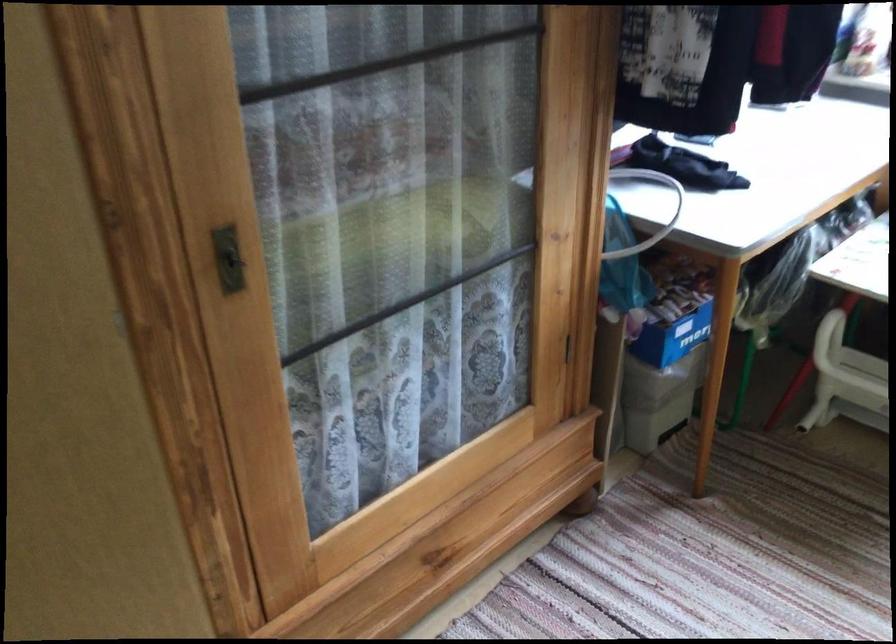
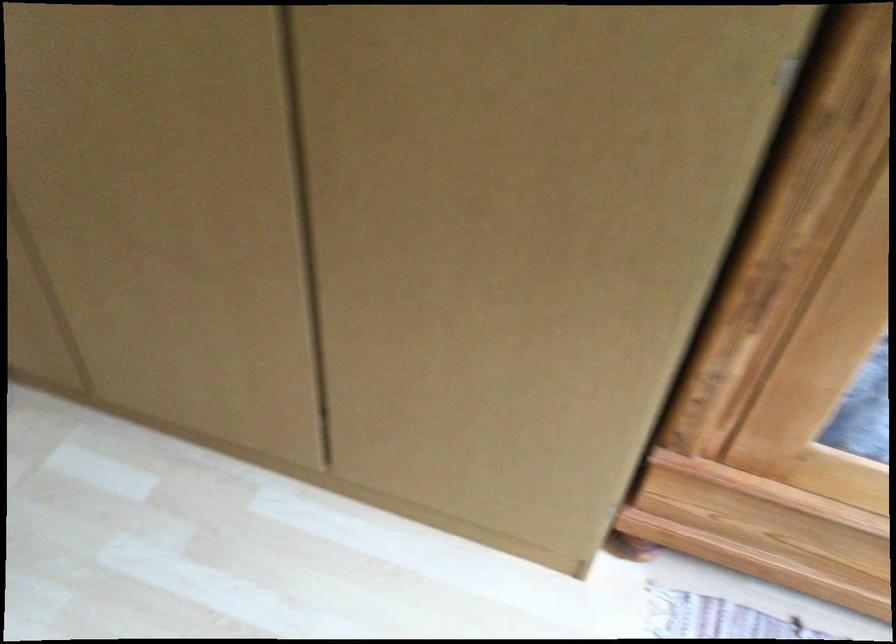
Consider the image. Based on the continuous images, in which direction is the camera rotating?

The camera's rotation is toward left-down.